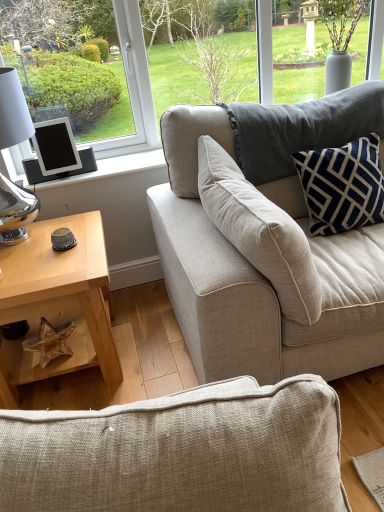
Question: Is navy velvet pillow at upper right facing towards beige fabric couch at upper right?

Choices:
 (A) yes
 (B) no

Answer: (B)

Question: Can you confirm if navy velvet pillow at upper right is taller than beige fabric couch at upper right?

Choices:
 (A) no
 (B) yes

Answer: (A)

Question: Is navy velvet pillow at upper right turned away from beige fabric couch at upper right?

Choices:
 (A) no
 (B) yes

Answer: (A)

Question: Does navy velvet pillow at upper right appear on the right side of beige fabric couch at upper right?

Choices:
 (A) yes
 (B) no

Answer: (A)

Question: Is navy velvet pillow at upper right further to the viewer compared to beige fabric couch at upper right?

Choices:
 (A) no
 (B) yes

Answer: (B)

Question: Is navy velvet pillow at upper right positioned before beige fabric couch at upper right?

Choices:
 (A) yes
 (B) no

Answer: (B)

Question: Does light wood/texture coffee table at lower left have a greater width compared to beige fabric couch at upper right?

Choices:
 (A) yes
 (B) no

Answer: (A)

Question: Is light wood/texture coffee table at lower left facing away from beige fabric couch at upper right?

Choices:
 (A) yes
 (B) no

Answer: (B)

Question: Does light wood/texture coffee table at lower left have a smaller size compared to beige fabric couch at upper right?

Choices:
 (A) yes
 (B) no

Answer: (B)

Question: Is there a large distance between light wood/texture coffee table at lower left and beige fabric couch at upper right?

Choices:
 (A) yes
 (B) no

Answer: (B)

Question: Is light wood/texture coffee table at lower left thinner than beige fabric couch at upper right?

Choices:
 (A) no
 (B) yes

Answer: (A)

Question: Does light wood/texture coffee table at lower left touch beige fabric couch at upper right?

Choices:
 (A) no
 (B) yes

Answer: (A)

Question: Does black matte tablet at left have a lesser width compared to beige fabric couch at upper right?

Choices:
 (A) no
 (B) yes

Answer: (B)